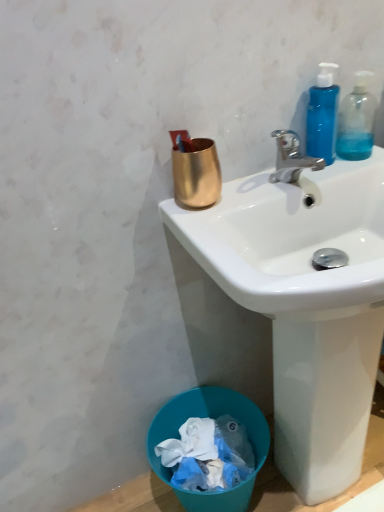
Where is `free space to the right of gold metallic cup at upper center`? The width and height of the screenshot is (384, 512). free space to the right of gold metallic cup at upper center is located at coordinates (257, 187).